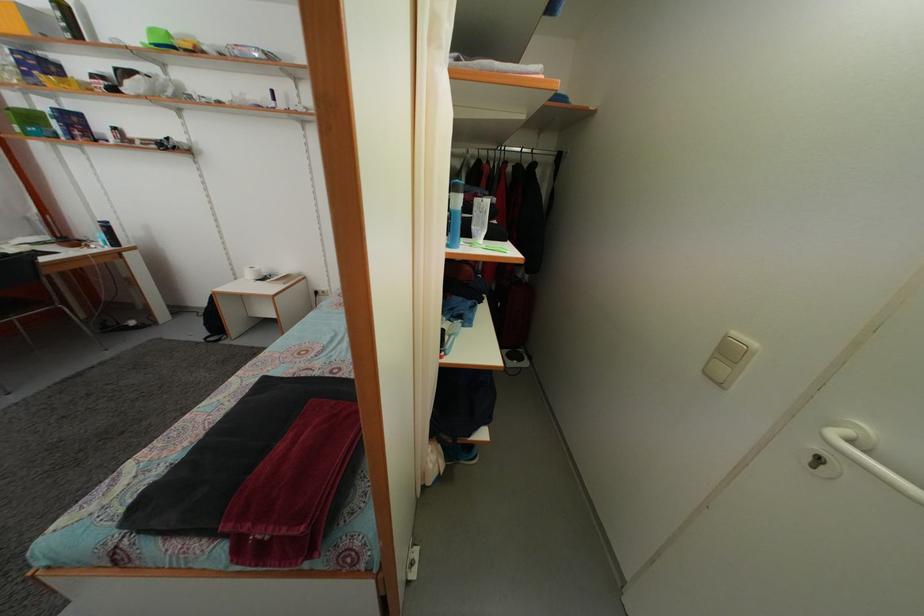
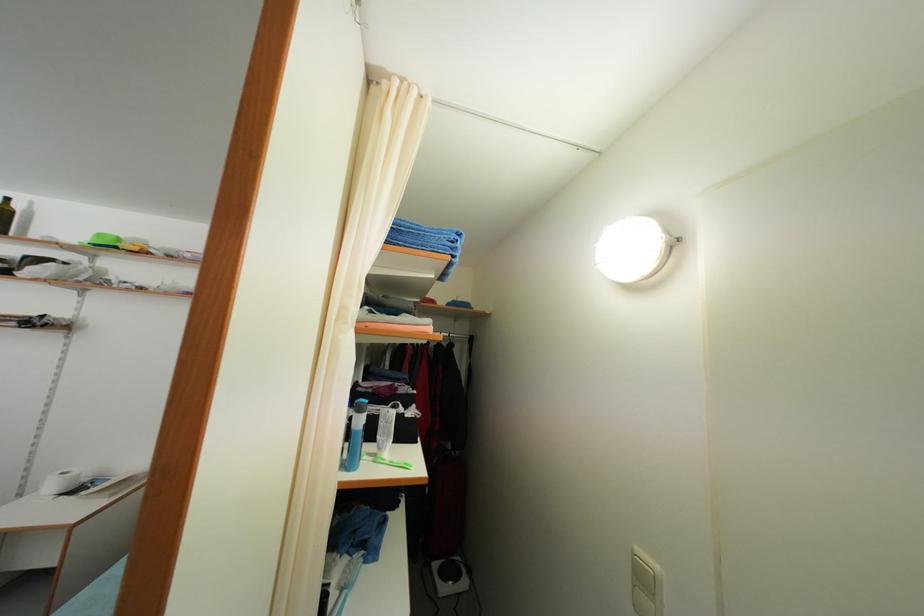
The point at [718,365] is marked in the first image. Where is the corresponding point in the second image?

(639, 593)